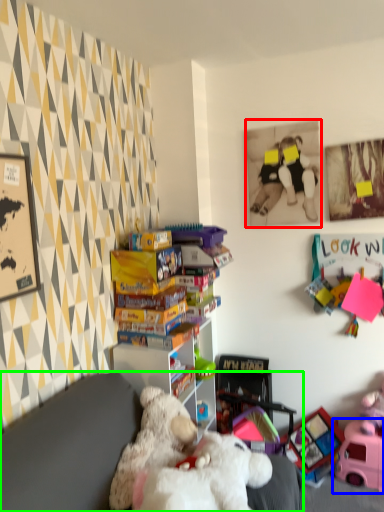
Question: Estimate the real-world distances between objects in this image. Which object is farther from picture frame (highlighted by a red box), toy (highlighted by a blue box) or furniture (highlighted by a green box)?

Choices:
 (A) toy
 (B) furniture

Answer: (B)